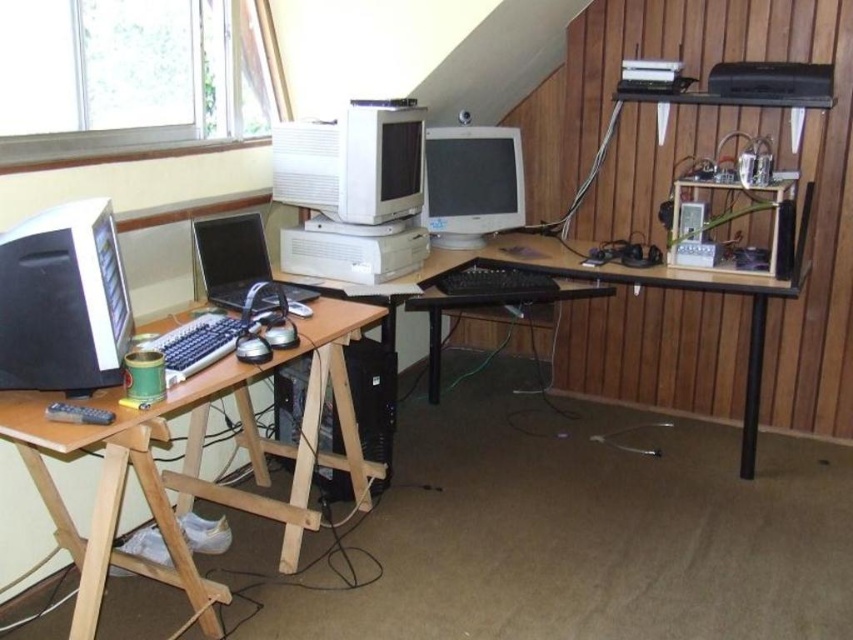
Question: Which point is closer to the camera?

Choices:
 (A) (38, 362)
 (B) (253, 264)
 (C) (389, 300)

Answer: (A)

Question: Where is light brown wood table at left located in relation to matte black keyboard at left in the image?

Choices:
 (A) right
 (B) left

Answer: (B)

Question: Which point appears farthest from the camera in this image?

Choices:
 (A) (653, 272)
 (B) (97, 593)
 (C) (53, 296)

Answer: (A)

Question: Which of the following is the closest to the observer?

Choices:
 (A) (782, 90)
 (B) (215, 330)
 (C) (306, 390)
 (D) (753, 400)

Answer: (B)

Question: Where is shiny silver laptop at center located in relation to black plastic keyboard at center in the image?

Choices:
 (A) left
 (B) right

Answer: (A)

Question: Is black plastic computer tower at lower center closer to camera compared to white plastic printer at center?

Choices:
 (A) yes
 (B) no

Answer: (A)